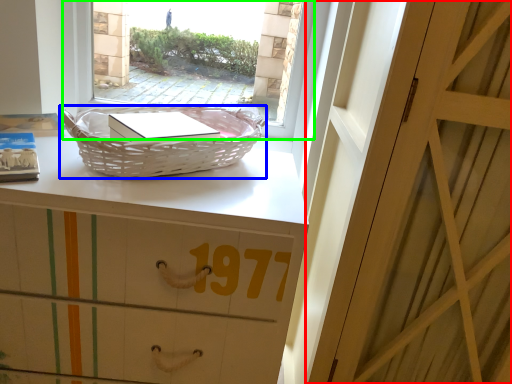
Question: Considering the real-world distances, which object is closest to door (highlighted by a red box)? picnic basket (highlighted by a blue box) or window (highlighted by a green box).

Choices:
 (A) picnic basket
 (B) window

Answer: (A)